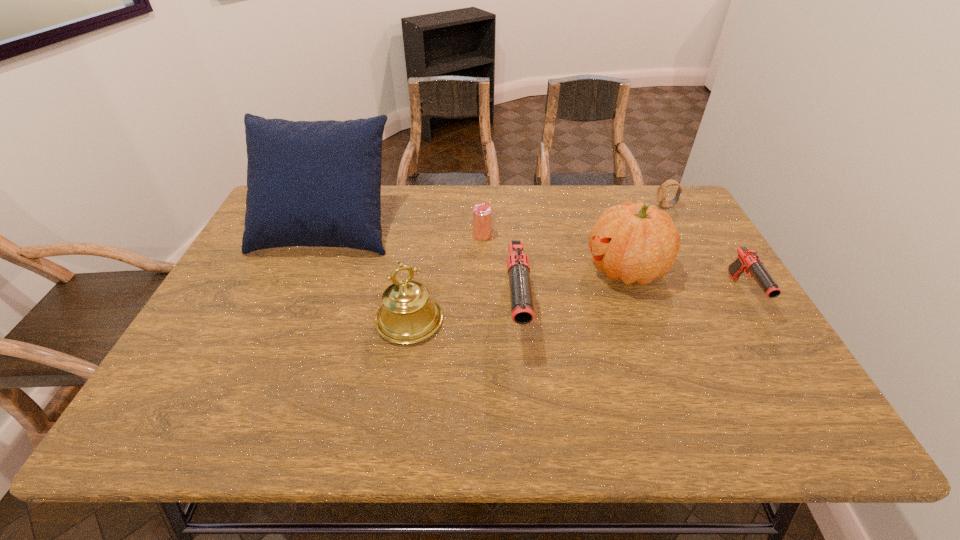
Identify the location of vacant space at the near edge of the desktop. The width and height of the screenshot is (960, 540). (611, 376).

The width and height of the screenshot is (960, 540). Identify the location of free region at the left edge. [x=228, y=289].

The width and height of the screenshot is (960, 540). In order to click on vacant region at the right edge in this screenshot , I will do `click(717, 302)`.

Identify the location of free space at the near left corner of the desktop. This screenshot has width=960, height=540. (236, 360).

Identify the location of vacant region between the leftmost object and the pumpkin. The image size is (960, 540). (476, 248).

Where is `unoccupied area between the watch and the left gun`? The width and height of the screenshot is (960, 540). unoccupied area between the watch and the left gun is located at coordinates (591, 260).

I want to click on empty space between the taller gun and the watch, so click(591, 260).

Image resolution: width=960 pixels, height=540 pixels. Identify the location of vacant space that's between the second object from right to left and the taller gun. click(x=591, y=260).

I want to click on free space between the third object from right to left and the tallest object, so click(476, 248).

This screenshot has height=540, width=960. Identify the location of vacant area that lies between the second tallest object and the beer can. (554, 252).